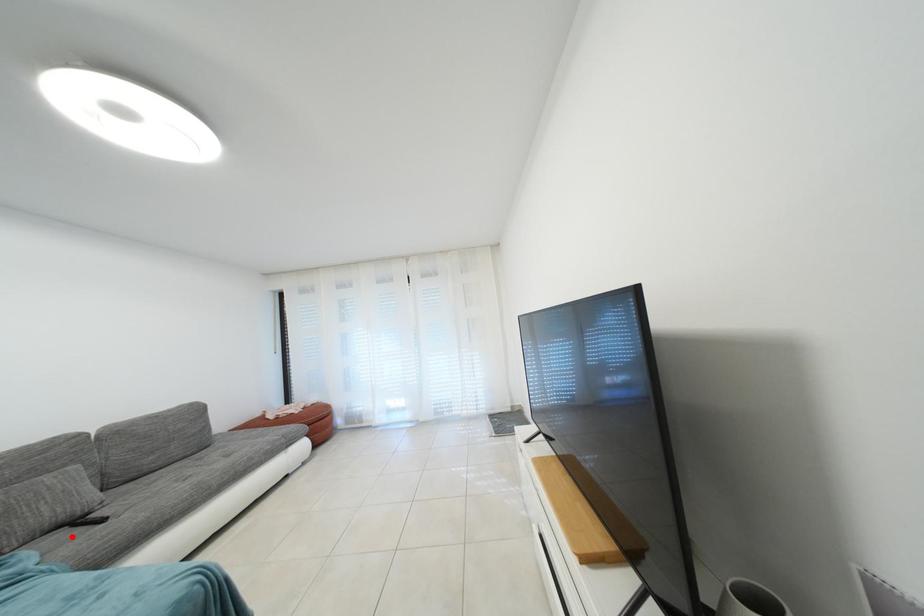
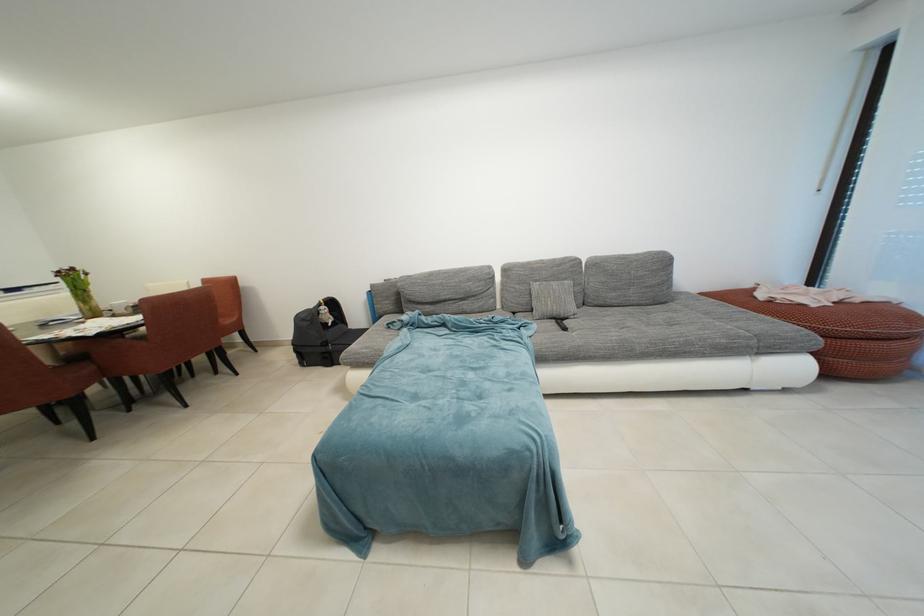
In the second image, find the point that corresponds to the highlighted location in the first image.

(560, 328)